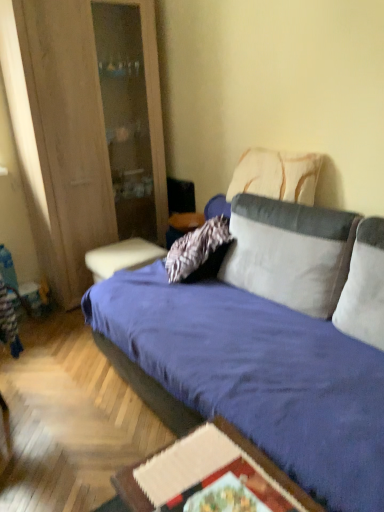
You are a GUI agent. You are given a task and a screenshot of the screen. Output one action in this format:
    pyautogui.click(x=<x>, y=<y>)
    Task: Click on the vacant space in wooden textured table at lower center, placed as the 2th table when sorted from top to bottom (from a real-world perspective)
    The width and height of the screenshot is (384, 512).
    Given the screenshot: What is the action you would take?
    pyautogui.click(x=208, y=481)